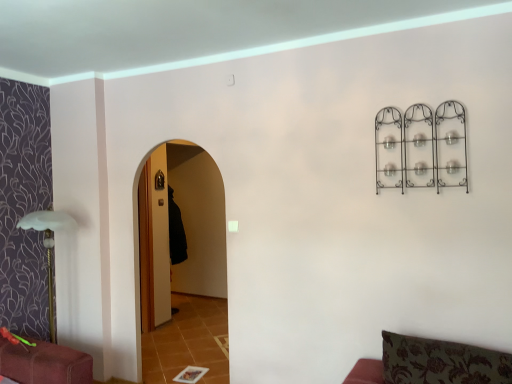
Question: From a real-world perspective, is green floral fabric cushion at lower right above or below black fabric robe at center?

Choices:
 (A) below
 (B) above

Answer: (A)

Question: Is green floral fabric cushion at lower right in front of or behind black fabric robe at center in the image?

Choices:
 (A) front
 (B) behind

Answer: (A)

Question: Looking at their shapes, would you say green floral fabric cushion at lower right is wider or thinner than black fabric robe at center?

Choices:
 (A) thin
 (B) wide

Answer: (B)

Question: Is black fabric robe at center inside or outside of green floral fabric cushion at lower right?

Choices:
 (A) outside
 (B) inside

Answer: (A)

Question: Considering the positions of black fabric robe at center and green floral fabric cushion at lower right in the image, is black fabric robe at center bigger or smaller than green floral fabric cushion at lower right?

Choices:
 (A) big
 (B) small

Answer: (B)

Question: From a real-world perspective, is black fabric robe at center positioned above or below green floral fabric cushion at lower right?

Choices:
 (A) below
 (B) above

Answer: (B)

Question: Is black fabric robe at center wider or thinner than green floral fabric cushion at lower right?

Choices:
 (A) thin
 (B) wide

Answer: (A)